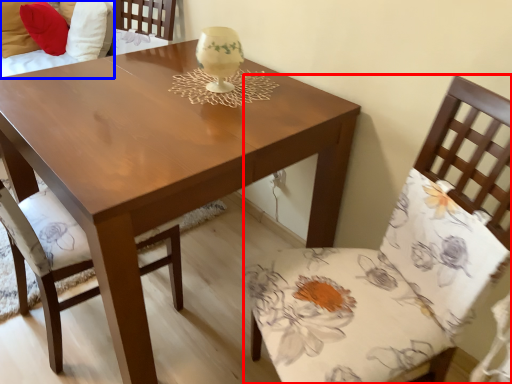
Question: Which point is closer to the camera, chair (highlighted by a red box) or couch (highlighted by a blue box)?

Choices:
 (A) chair
 (B) couch

Answer: (A)